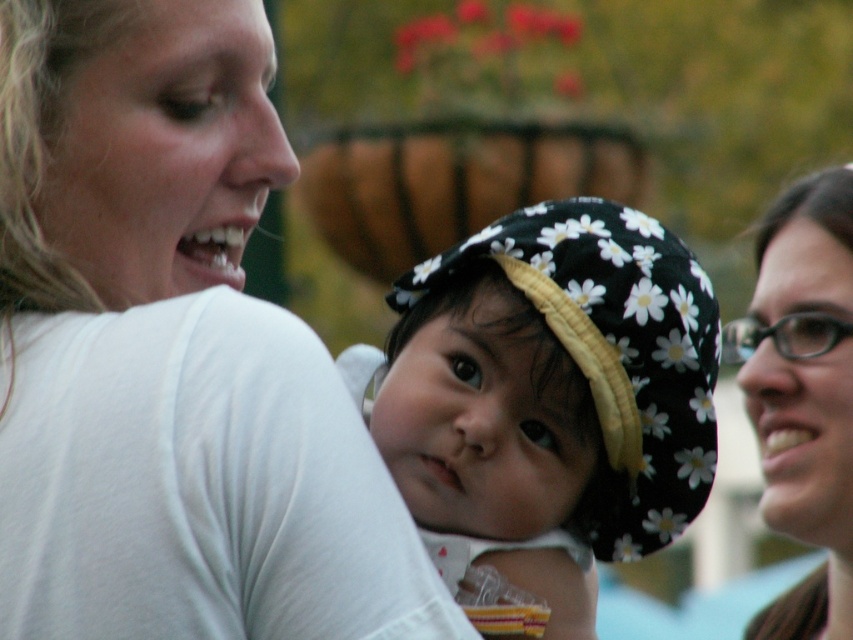
Is white matte shirt at upper left to the left of floral fabric hat at center from the viewer's perspective?

Indeed, white matte shirt at upper left is positioned on the left side of floral fabric hat at center.

Between white matte shirt at upper left and floral fabric hat at center, which one is positioned lower?

floral fabric hat at center is lower down.

Between point (102, 236) and point (515, 256), which one is positioned in front?

Point (515, 256)

Identify the location of white matte shirt at upper left. This screenshot has width=853, height=640. coord(172,355).

Describe the element at coordinates (172, 355) in the screenshot. The height and width of the screenshot is (640, 853). I see `white matte shirt at upper left` at that location.

Can you confirm if white matte shirt at upper left is positioned below brown matte glasses at right?

Correct, white matte shirt at upper left is located below brown matte glasses at right.

Is point (199, 67) closer to viewer compared to point (793, 352)?

Yes, point (199, 67) is closer to viewer.

Identify the location of white matte shirt at upper left. The height and width of the screenshot is (640, 853). (172, 355).

Which is behind, point (503, 570) or point (786, 602)?

Positioned behind is point (786, 602).

Does floral fabric hat at center have a lesser width compared to brown matte glasses at right?

Yes.

Does point (474, 262) come behind point (793, 452)?

No, it is not.

Where is `floral fabric hat at center`? floral fabric hat at center is located at coordinates (548, 397).